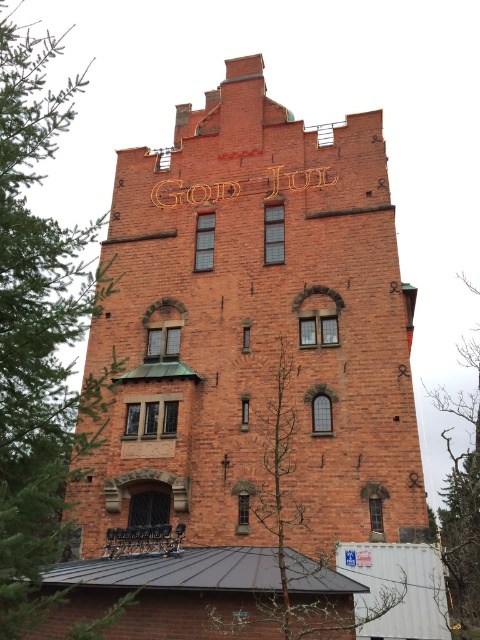
Looking at this image, you are planning to decorate both the green leafy tree at left and the bare branches at center for the holiday season. Based on their sizes, which one might require more ornaments to achieve a similar level of decoration?

The green leafy tree at left is larger in size than the bare branches at center, so it would require more ornaments to achieve a similar level of decoration.